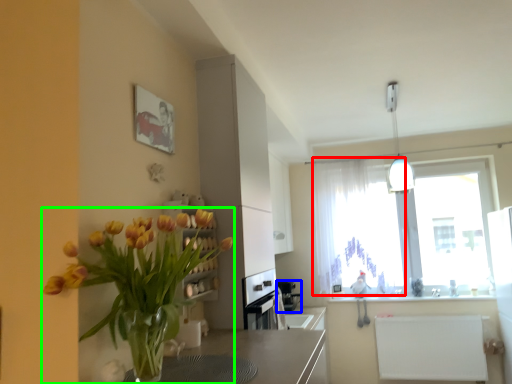
Question: Which object is positioned closest to curtain (highlighted by a red box)? Select from appliance (highlighted by a blue box) and houseplant (highlighted by a green box).

Choices:
 (A) appliance
 (B) houseplant

Answer: (A)